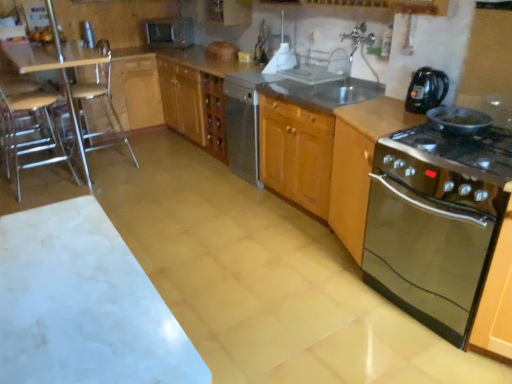
Question: From the image's perspective, does satin silver microwave at upper center appear higher than satin silver dishwasher at center?

Choices:
 (A) yes
 (B) no

Answer: (A)

Question: Is satin silver microwave at upper center not inside satin silver dishwasher at center?

Choices:
 (A) yes
 (B) no

Answer: (A)

Question: Is satin silver microwave at upper center thinner than satin silver dishwasher at center?

Choices:
 (A) no
 (B) yes

Answer: (B)

Question: Does satin silver microwave at upper center touch satin silver dishwasher at center?

Choices:
 (A) no
 (B) yes

Answer: (A)

Question: Does satin silver microwave at upper center have a smaller size compared to satin silver dishwasher at center?

Choices:
 (A) yes
 (B) no

Answer: (A)

Question: Is satin silver microwave at upper center at the right side of satin silver dishwasher at center?

Choices:
 (A) yes
 (B) no

Answer: (B)

Question: Is metallic silver toaster at upper left not near black plastic kettle at upper right, the second kitchen appliance in the bottom-to-top sequence?

Choices:
 (A) no
 (B) yes

Answer: (B)

Question: Is metallic silver toaster at upper left oriented away from black plastic kettle at upper right, the second kitchen appliance in the bottom-to-top sequence?

Choices:
 (A) yes
 (B) no

Answer: (B)

Question: Is the depth of metallic silver toaster at upper left less than that of black plastic kettle at upper right, arranged as the 1th kitchen appliance when viewed from the top?

Choices:
 (A) yes
 (B) no

Answer: (B)

Question: Is metallic silver toaster at upper left positioned beyond the bounds of black plastic kettle at upper right, the second kitchen appliance in the bottom-to-top sequence?

Choices:
 (A) yes
 (B) no

Answer: (A)

Question: Does metallic silver toaster at upper left have a greater width compared to black plastic kettle at upper right, arranged as the 1th kitchen appliance when viewed from the top?

Choices:
 (A) yes
 (B) no

Answer: (B)

Question: From the image's perspective, is metallic silver toaster at upper left over black plastic kettle at upper right, the second kitchen appliance in the bottom-to-top sequence?

Choices:
 (A) yes
 (B) no

Answer: (A)

Question: Does wooden seat at left, which is the first bar stool from left to right, come behind satin silver microwave at upper center?

Choices:
 (A) no
 (B) yes

Answer: (A)